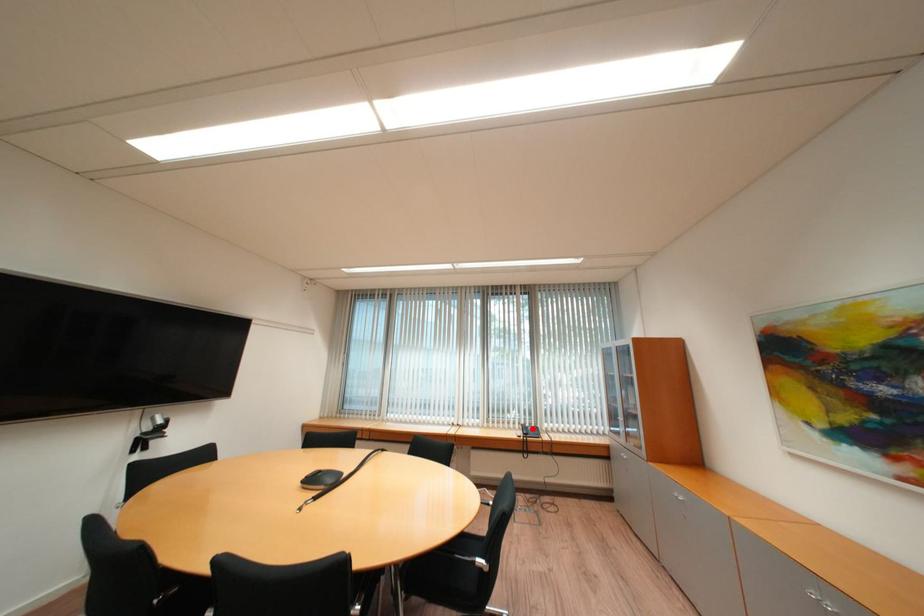
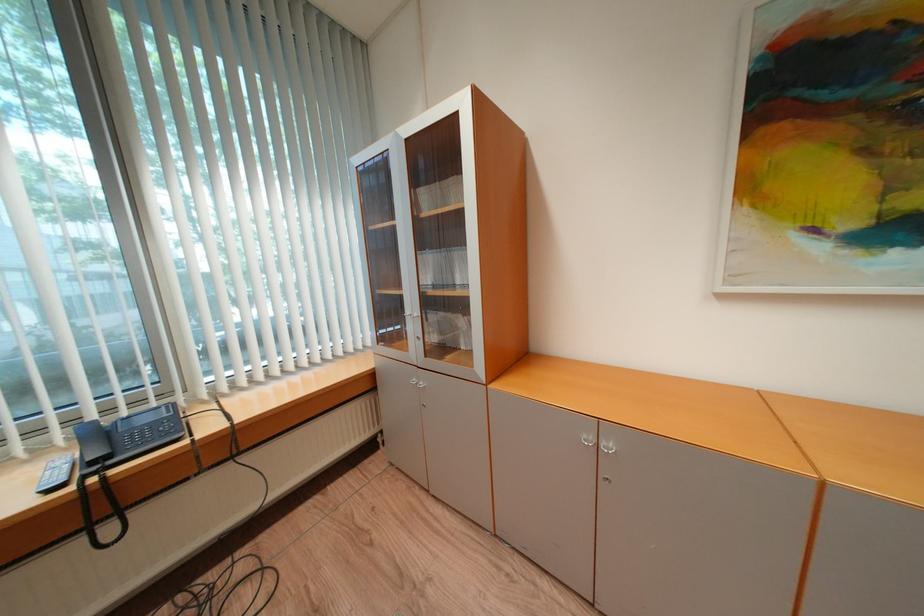
Question: A red point is marked in image1. In image2, is the corresponding 3D point closer to the camera or farther? Reply with the corresponding letter.

Choices:
 (A) The corresponding 3D point is closer.
 (B) The corresponding 3D point is farther.

Answer: (A)